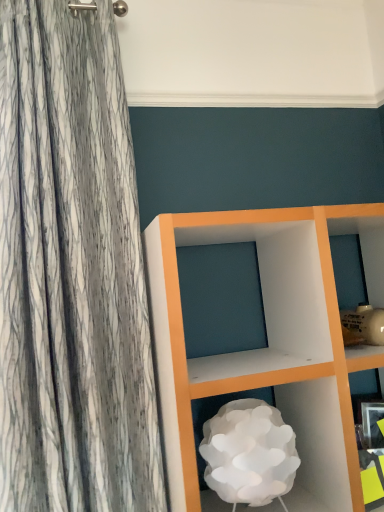
The image size is (384, 512). What do you see at coordinates (320, 439) in the screenshot? I see `white matte lampshade at lower center` at bounding box center [320, 439].

Based on the photo, in order to face white matte lampshade at lower center, should I rotate leftwards or rightwards?

Turn right by 7.930 degrees to look at white matte lampshade at lower center.

Where is `white matte lampshade at lower center`? This screenshot has height=512, width=384. white matte lampshade at lower center is located at coordinates (320, 439).

Image resolution: width=384 pixels, height=512 pixels. I want to click on white matte lampshade at lower center, so click(320, 439).